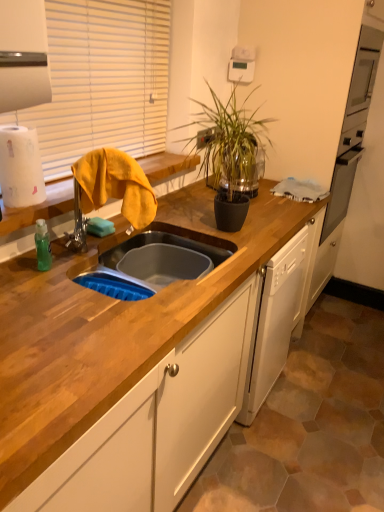
At what (x,y) coordinates should I click in order to perform the action: click on empty space that is ontop of wooden countertop at center. Please return your answer as a coordinate pair (x, y). Looking at the image, I should click on (160, 217).